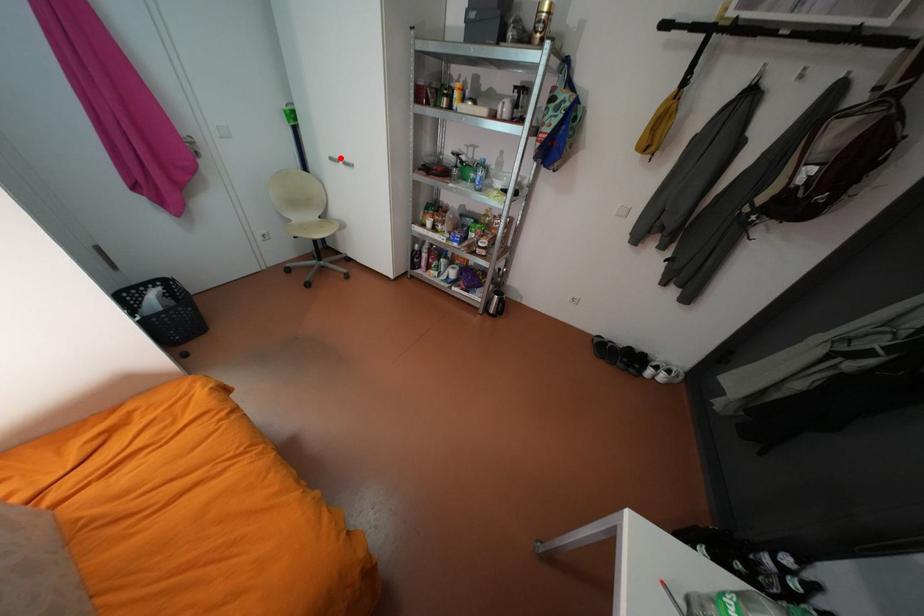
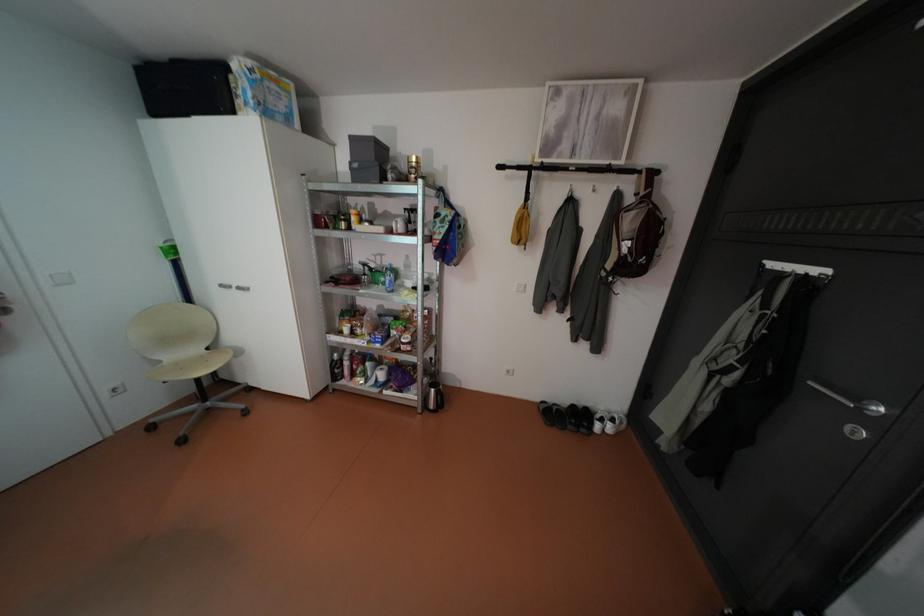
The point at the highlighted location is marked in the first image. Where is the corresponding point in the second image?

(232, 285)